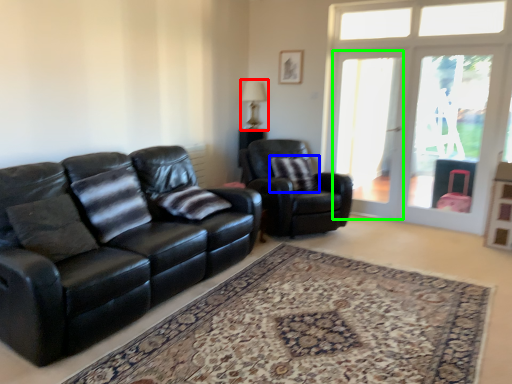
Question: Estimate the real-world distances between objects in this image. Which object is closer to lamp (highlighted by a red box), pillow (highlighted by a blue box) or screen door (highlighted by a green box)?

Choices:
 (A) pillow
 (B) screen door

Answer: (A)